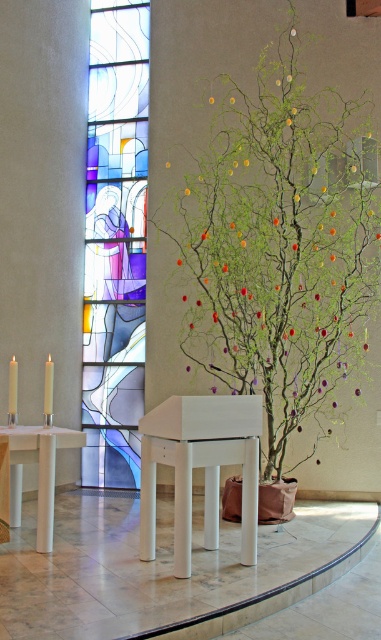
Can you confirm if green matte tree at center is shorter than white wax candle at left?

In fact, green matte tree at center may be taller than white wax candle at left.

Between green matte tree at center and white wax candle at left, which one is positioned lower?

Positioned lower is white wax candle at left.

Between point (206, 371) and point (44, 364), which one is positioned behind?

Point (206, 371)

Where is `green matte tree at center`? The image size is (381, 640). green matte tree at center is located at coordinates (270, 212).

From the picture: Is the position of green matte tree at center less distant than that of stained glass window at center?

That is True.

Which is behind, point (280, 189) or point (86, 275)?

The point (86, 275) is more distant.

The image size is (381, 640). I want to click on green matte tree at center, so click(x=270, y=212).

Which of these two, stained glass window at center or white wax candle at left, stands shorter?

With less height is white wax candle at left.

Is stained glass window at center positioned in front of white wax candle at left?

No, stained glass window at center is behind white wax candle at left.

Locate an element on the screen. stained glass window at center is located at coordinates (115, 243).